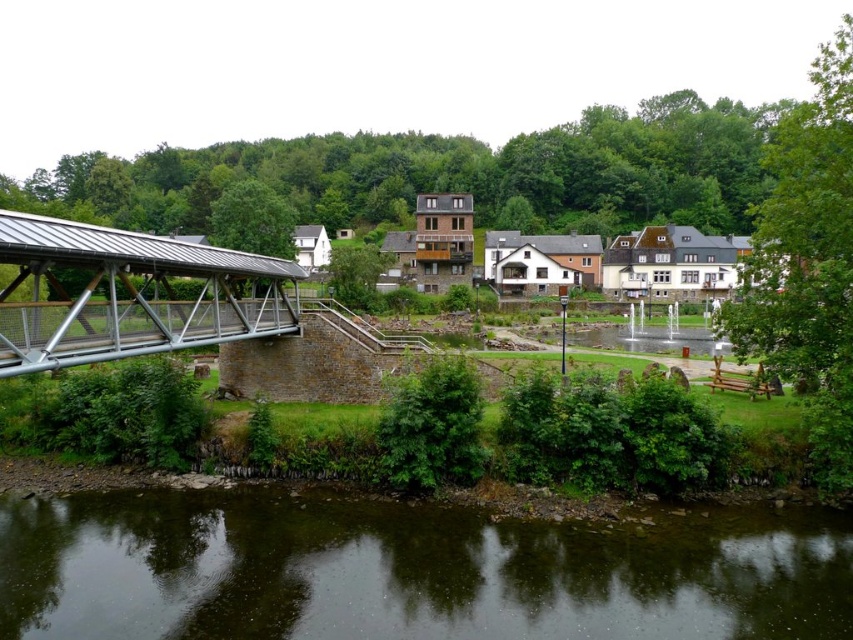
Does dark brown water at lower center have a larger size compared to metallic gray bridge at left?

No.

Is point (572, 595) closer to camera compared to point (241, 305)?

Yes, it is in front of point (241, 305).

Find the location of a particular element. Image resolution: width=853 pixels, height=640 pixels. dark brown water at lower center is located at coordinates (410, 572).